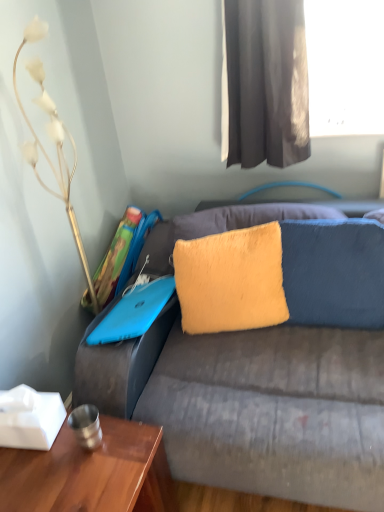
Image resolution: width=384 pixels, height=512 pixels. Describe the element at coordinates (334, 272) in the screenshot. I see `yellow fuzzy pillow at center, marked as the first pillow in a right-to-left arrangement` at that location.

Describe the element at coordinates (264, 83) in the screenshot. I see `dark gray fabric curtain at upper center` at that location.

Find the location of `yellow furry pillow at center, which ranks as the 2th pillow in right-to-left order`. yellow furry pillow at center, which ranks as the 2th pillow in right-to-left order is located at coordinates (231, 280).

The width and height of the screenshot is (384, 512). Describe the element at coordinates (134, 312) in the screenshot. I see `blue matte laptop at upper left` at that location.

This screenshot has width=384, height=512. Find the location of `yellow fuzzy pillow at center, placed as the 2th pillow when sorted from left to right`. yellow fuzzy pillow at center, placed as the 2th pillow when sorted from left to right is located at coordinates (334, 272).

Who is shorter, yellow furry pillow at center, which ranks as the 2th pillow in right-to-left order, or yellow fuzzy pillow at center, placed as the 2th pillow when sorted from left to right?

yellow furry pillow at center, which ranks as the 2th pillow in right-to-left order.

From a real-world perspective, is yellow furry pillow at center, which ranks as the first pillow in left-to-right order, on yellow fuzzy pillow at center, marked as the first pillow in a right-to-left arrangement?

Yes, from a real-world perspective, yellow furry pillow at center, which ranks as the first pillow in left-to-right order, is on top of yellow fuzzy pillow at center, marked as the first pillow in a right-to-left arrangement.

Is yellow furry pillow at center, which ranks as the 2th pillow in right-to-left order, wider than yellow fuzzy pillow at center, placed as the 2th pillow when sorted from left to right?

Indeed, yellow furry pillow at center, which ranks as the 2th pillow in right-to-left order, has a greater width compared to yellow fuzzy pillow at center, placed as the 2th pillow when sorted from left to right.

Is yellow furry pillow at center, which ranks as the first pillow in left-to-right order, spatially inside yellow fuzzy pillow at center, marked as the first pillow in a right-to-left arrangement, or outside of it?

yellow furry pillow at center, which ranks as the first pillow in left-to-right order, is not inside yellow fuzzy pillow at center, marked as the first pillow in a right-to-left arrangement, it's outside.

Is yellow furry pillow at center, which ranks as the 2th pillow in right-to-left order, at the right side of wooden table at lower left?

Yes.

Is yellow furry pillow at center, which ranks as the 2th pillow in right-to-left order, positioned beyond the bounds of wooden table at lower left?

Yes, yellow furry pillow at center, which ranks as the 2th pillow in right-to-left order, is not within wooden table at lower left.

Considering the positions of objects yellow furry pillow at center, which ranks as the first pillow in left-to-right order, and wooden table at lower left in the image provided, who is in front, yellow furry pillow at center, which ranks as the first pillow in left-to-right order, or wooden table at lower left?

wooden table at lower left is in front.

Does point (194, 264) come in front of point (111, 428)?

That is False.

Is blue matte laptop at upper left not close to wooden table at lower left?

They are positioned close to each other.

From a real-world perspective, which is physically below, blue matte laptop at upper left or wooden table at lower left?

wooden table at lower left, from a real-world perspective.

How different are the orientations of blue matte laptop at upper left and wooden table at lower left in degrees?

1.89 degrees.

In terms of width, does metallic gold decorative at left look wider or thinner when compared to dark gray fabric curtain at upper center?

Clearly, metallic gold decorative at left has more width compared to dark gray fabric curtain at upper center.

From the image's perspective, is metallic gold decorative at left on dark gray fabric curtain at upper center?

No, from the image's perspective, metallic gold decorative at left is not above dark gray fabric curtain at upper center.

From the picture: Is metallic gold decorative at left next to dark gray fabric curtain at upper center?

metallic gold decorative at left and dark gray fabric curtain at upper center are not in contact.

Considering the relative positions of metallic gold decorative at left and dark gray fabric curtain at upper center in the image provided, is metallic gold decorative at left in front of dark gray fabric curtain at upper center?

Yes, metallic gold decorative at left is closer to the viewer.

Visually, is wooden table at lower left positioned to the left or to the right of blue matte laptop at upper left?

Based on their positions, wooden table at lower left is located to the left of blue matte laptop at upper left.

Does wooden table at lower left have a smaller size compared to blue matte laptop at upper left?

No.

Which is nearer, (135, 423) or (145, 315)?

Point (135, 423) is positioned closer to the camera compared to point (145, 315).

Where is `laptop behind the wooden table at lower left`? laptop behind the wooden table at lower left is located at coordinates (134, 312).

Which is behind, point (224, 50) or point (251, 277)?

The point (224, 50) is behind.

Is dark gray fabric curtain at upper center touching yellow furry pillow at center, which ranks as the first pillow in left-to-right order?

dark gray fabric curtain at upper center is not next to yellow furry pillow at center, which ranks as the first pillow in left-to-right order, and they're not touching.

Is yellow furry pillow at center, which ranks as the first pillow in left-to-right order, located within dark gray fabric curtain at upper center?

That's incorrect, yellow furry pillow at center, which ranks as the first pillow in left-to-right order, is not inside dark gray fabric curtain at upper center.

Considering their positions, is dark gray fabric curtain at upper center located in front of or behind yellow furry pillow at center, which ranks as the first pillow in left-to-right order?

In the image, dark gray fabric curtain at upper center appears in front of yellow furry pillow at center, which ranks as the first pillow in left-to-right order.

You are a GUI agent. You are given a task and a screenshot of the screen. Output one action in this format:
    pyautogui.click(x=<x>, y=<y>)
    Task: Click on the lamp that is behind the wooden table at lower left
    This screenshot has height=512, width=384.
    Given the screenshot: What is the action you would take?
    pyautogui.click(x=56, y=146)

Can you tell me how much metallic gold decorative at left and wooden table at lower left differ in facing direction?

4.1 degrees separate the facing orientations of metallic gold decorative at left and wooden table at lower left.

Considering the relative sizes of metallic gold decorative at left and wooden table at lower left in the image provided, is metallic gold decorative at left thinner than wooden table at lower left?

Indeed, metallic gold decorative at left has a lesser width compared to wooden table at lower left.

This screenshot has height=512, width=384. Find the location of `pillow in front of the yellow furry pillow at center, which ranks as the 2th pillow in right-to-left order`. pillow in front of the yellow furry pillow at center, which ranks as the 2th pillow in right-to-left order is located at coordinates (334, 272).

Where is `table beneath the yellow furry pillow at center, which ranks as the 2th pillow in right-to-left order (from a real-world perspective)`? The height and width of the screenshot is (512, 384). table beneath the yellow furry pillow at center, which ranks as the 2th pillow in right-to-left order (from a real-world perspective) is located at coordinates (91, 473).

When comparing their distances from dark gray fabric curtain at upper center, does yellow furry pillow at center, which ranks as the first pillow in left-to-right order, or blue matte laptop at upper left seem closer?

yellow furry pillow at center, which ranks as the first pillow in left-to-right order, is positioned closer to the anchor dark gray fabric curtain at upper center.

Estimate the real-world distances between objects in this image. Which object is further from yellow furry pillow at center, which ranks as the first pillow in left-to-right order, blue matte laptop at upper left or wooden table at lower left?

Based on the image, wooden table at lower left appears to be further to yellow furry pillow at center, which ranks as the first pillow in left-to-right order.

Which object lies further to the anchor point dark gray fabric curtain at upper center, yellow furry pillow at center, which ranks as the first pillow in left-to-right order, or metallic gold decorative at left?

The object further to dark gray fabric curtain at upper center is metallic gold decorative at left.

Which object lies nearer to the anchor point metallic gold decorative at left, yellow furry pillow at center, which ranks as the 2th pillow in right-to-left order, or wooden table at lower left?

yellow furry pillow at center, which ranks as the 2th pillow in right-to-left order.

Considering their positions, is metallic gold decorative at left positioned closer to blue matte laptop at upper left than dark gray fabric curtain at upper center?

metallic gold decorative at left is positioned closer to the anchor blue matte laptop at upper left.

Considering their positions, is dark gray fabric curtain at upper center positioned further to wooden table at lower left than blue matte laptop at upper left?

dark gray fabric curtain at upper center lies further to wooden table at lower left than the other object.

Looking at the image, which one is located closer to yellow fuzzy pillow at center, placed as the 2th pillow when sorted from left to right, wooden table at lower left or dark gray fabric curtain at upper center?

The object closer to yellow fuzzy pillow at center, placed as the 2th pillow when sorted from left to right, is dark gray fabric curtain at upper center.

Based on their spatial positions, is blue matte laptop at upper left or dark gray fabric curtain at upper center closer to yellow furry pillow at center, which ranks as the first pillow in left-to-right order?

The object closer to yellow furry pillow at center, which ranks as the first pillow in left-to-right order, is blue matte laptop at upper left.

What are the coordinates of `pillow between dark gray fabric curtain at upper center and yellow furry pillow at center, which ranks as the 2th pillow in right-to-left order, in the up-down direction` in the screenshot? It's located at (334, 272).

Where is `laptop between metallic gold decorative at left and wooden table at lower left vertically`? laptop between metallic gold decorative at left and wooden table at lower left vertically is located at coordinates (134, 312).

Find the location of a particular element. The height and width of the screenshot is (512, 384). lamp between dark gray fabric curtain at upper center and blue matte laptop at upper left from top to bottom is located at coordinates (56, 146).

The image size is (384, 512). I want to click on pillow between metallic gold decorative at left and dark gray fabric curtain at upper center from left to right, so click(231, 280).